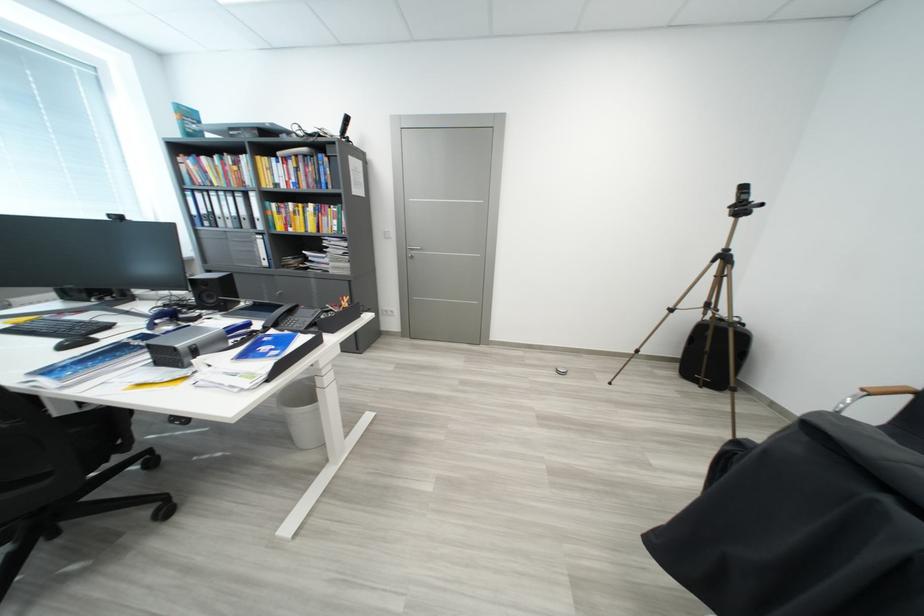
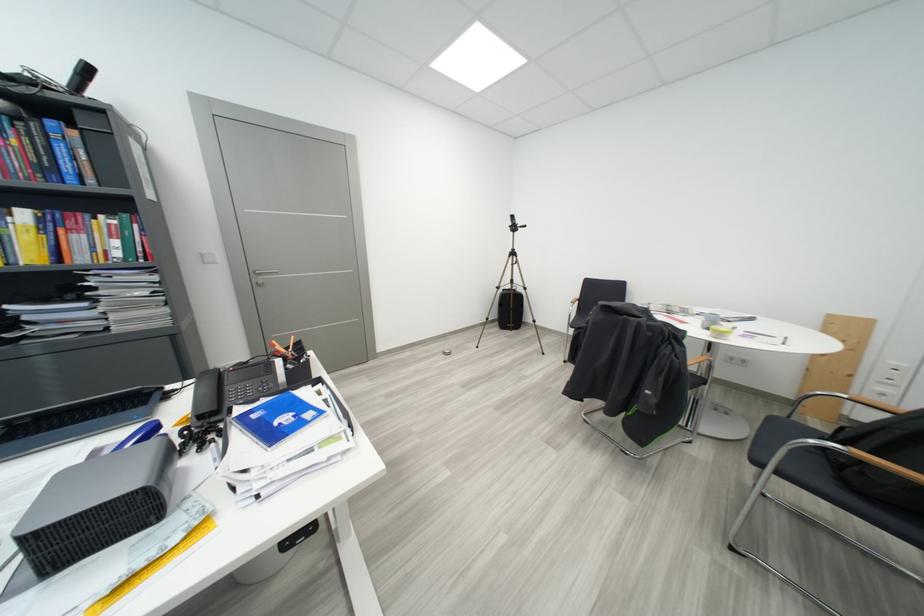
Find the pixel in the second image that matches (274,342) in the first image.

(263, 419)